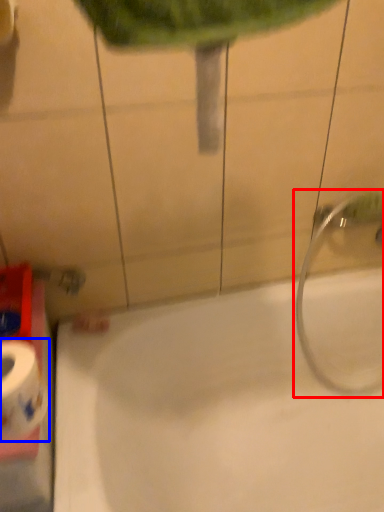
Question: Which object is closer to the camera taking this photo, plumbing fixture (highlighted by a red box) or toilet paper (highlighted by a blue box)?

Choices:
 (A) plumbing fixture
 (B) toilet paper

Answer: (B)